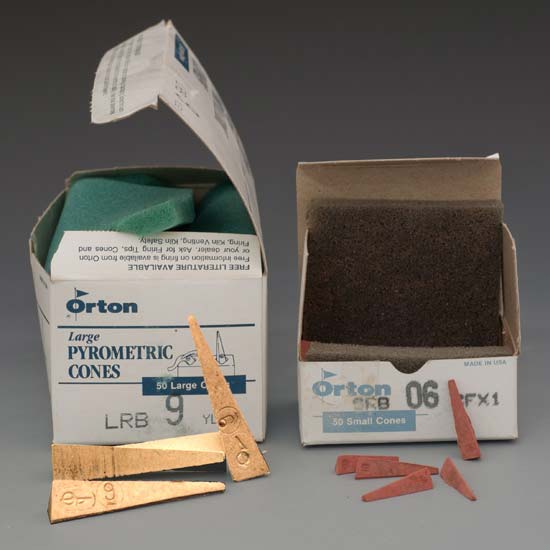
You are a GUI agent. You are given a task and a screenshot of the screen. Output one action in this format:
    pyautogui.click(x=<x>, y=<y>)
    Task: Click on the green sponge
    This screenshot has height=550, width=550.
    Given the screenshot: What is the action you would take?
    pyautogui.click(x=162, y=206), pyautogui.click(x=218, y=211)